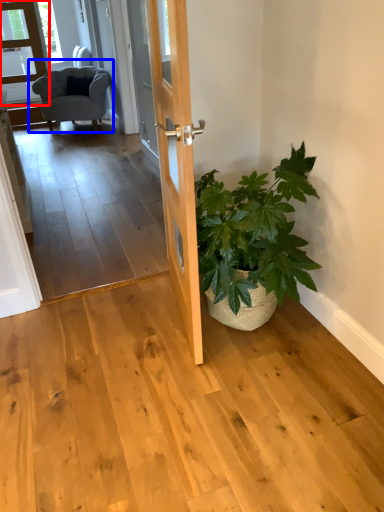
Question: Among these objects, which one is nearest to the camera, glass door (highlighted by a red box) or chair (highlighted by a blue box)?

Choices:
 (A) glass door
 (B) chair

Answer: (B)